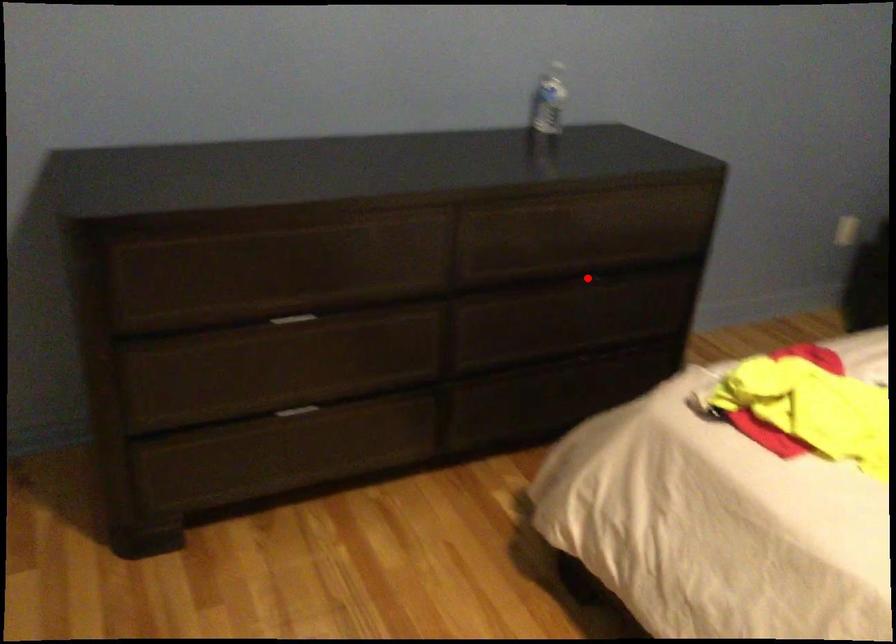
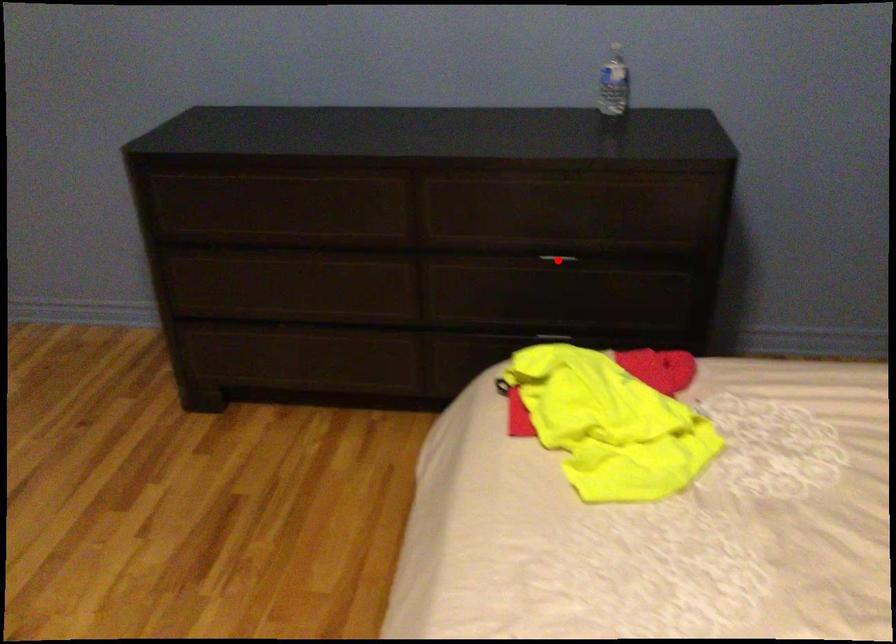
I am providing you with two images of the same scene from different viewpoints. A red point is marked on the first image and another point is marked on the second image. Do the highlighted points in image1 and image2 indicate the same real-world spot?

Yes